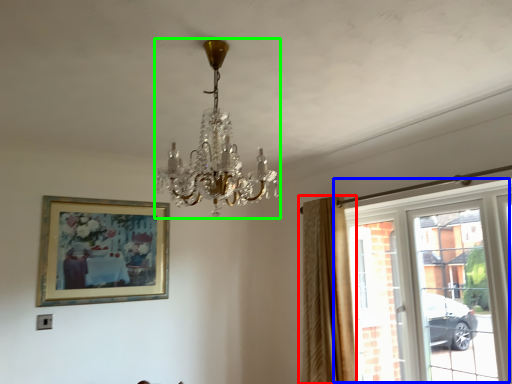
Question: Considering the real-world distances, which object is closest to curtain (highlighted by a red box)? window (highlighted by a blue box) or lamp (highlighted by a green box).

Choices:
 (A) window
 (B) lamp

Answer: (A)